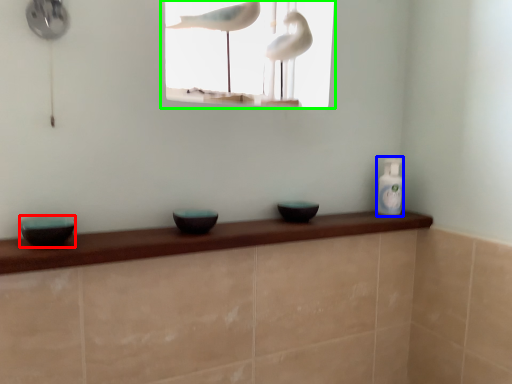
Question: Considering the real-world distances, which object is closest to basin (highlighted by a red box)? bottle (highlighted by a blue box) or window (highlighted by a green box).

Choices:
 (A) bottle
 (B) window

Answer: (A)